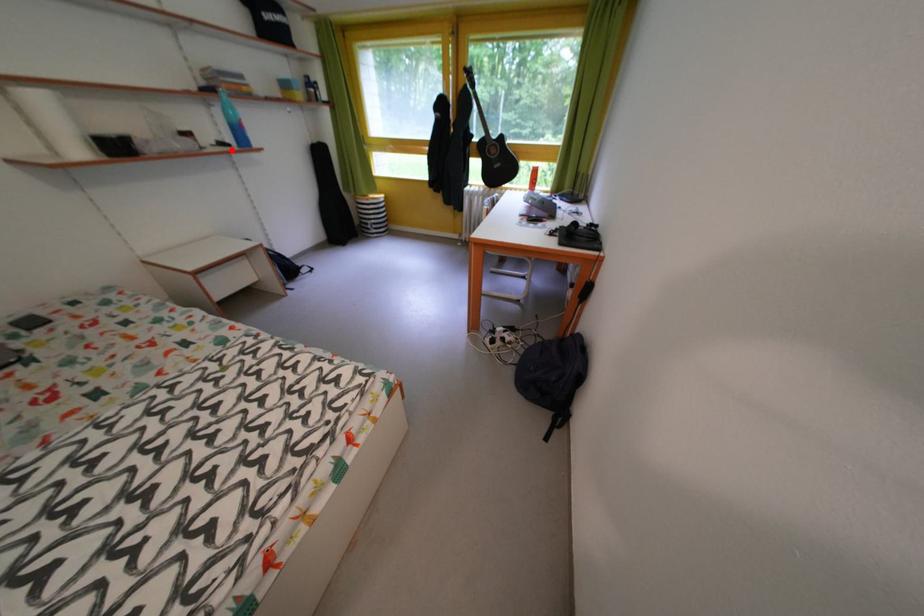
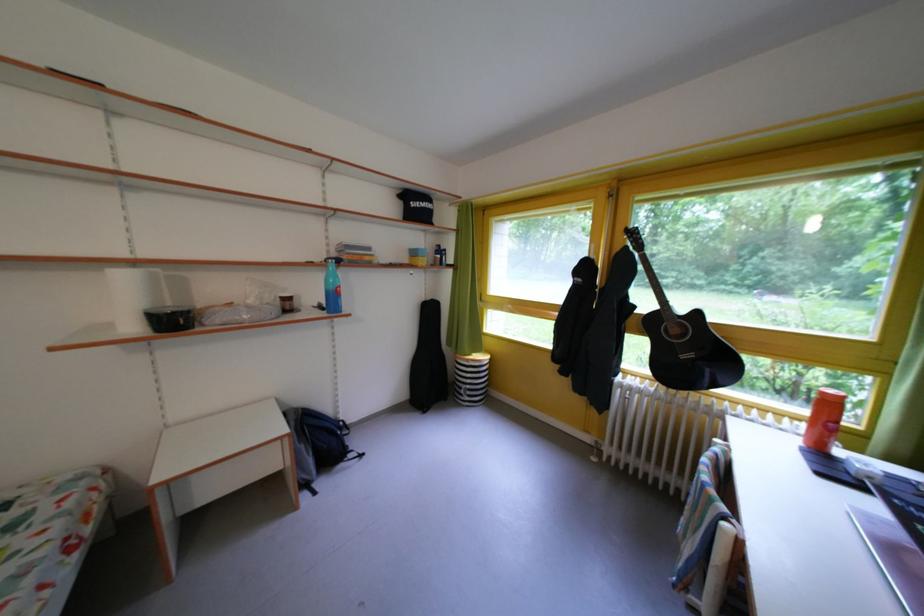
Where in the second image is the point corresponding to the highlighted location from the first image?

(331, 313)